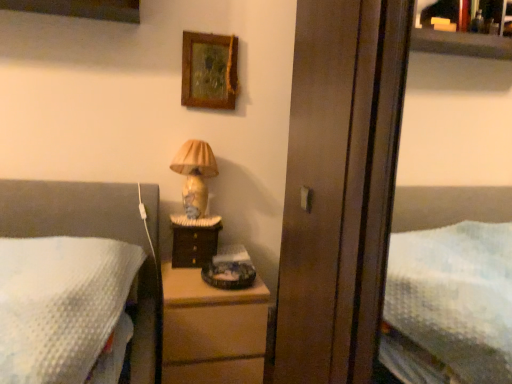
Image resolution: width=512 pixels, height=384 pixels. Describe the element at coordinates (211, 327) in the screenshot. I see `wooden chest of drawers at center` at that location.

Where is `wooden picture frame at upper center`? wooden picture frame at upper center is located at coordinates (209, 71).

The width and height of the screenshot is (512, 384). In order to click on wooden screen door at center in this screenshot , I will do 316,186.

The width and height of the screenshot is (512, 384). What are the coordinates of `screen door above the wooden chest of drawers at center (from the image's perspective)` in the screenshot? It's located at (x=316, y=186).

Does point (258, 286) appear closer or farther from the camera than point (292, 287)?

Clearly, point (258, 286) is more distant from the camera than point (292, 287).

Are wooden chest of drawers at center and wooden screen door at center far apart?

That's not correct — wooden chest of drawers at center is a little close to wooden screen door at center.

Can you tell me how much wooden chest of drawers at center and wooden screen door at center differ in facing direction?

The facing directions of wooden chest of drawers at center and wooden screen door at center are 92.1 degrees apart.

From their relative heights in the image, would you say matte ceramic lamp at upper center is taller or shorter than wooden picture frame at upper center?

matte ceramic lamp at upper center is taller than wooden picture frame at upper center.

Considering the relative positions of matte ceramic lamp at upper center and wooden picture frame at upper center in the image provided, is matte ceramic lamp at upper center behind wooden picture frame at upper center?

No, it is in front of wooden picture frame at upper center.

From the picture: From the image's perspective, is matte ceramic lamp at upper center below wooden picture frame at upper center?

Yes, from the image's perspective, matte ceramic lamp at upper center is beneath wooden picture frame at upper center.

Which is more to the left, matte ceramic lamp at upper center or wooden picture frame at upper center?

matte ceramic lamp at upper center is more to the left.

Which object is positioned more to the left, wooden picture frame at upper center or wooden chest of drawers at center?

From the viewer's perspective, wooden chest of drawers at center appears more on the left side.

Is wooden picture frame at upper center bigger than wooden chest of drawers at center?

Incorrect, wooden picture frame at upper center is not larger than wooden chest of drawers at center.

Which object is further away from the camera taking this photo, wooden picture frame at upper center or wooden chest of drawers at center?

wooden picture frame at upper center is further from the camera.

Can you confirm if matte ceramic lamp at upper center is smaller than dark wood nightstand at center?

No, matte ceramic lamp at upper center is not smaller than dark wood nightstand at center.

How many degrees apart are the facing directions of matte ceramic lamp at upper center and dark wood nightstand at center?

The facing directions of matte ceramic lamp at upper center and dark wood nightstand at center are 0.000605 degrees apart.

Is matte ceramic lamp at upper center aimed at dark wood nightstand at center?

No.

Considering the positions of points (182, 156) and (220, 224), is point (182, 156) closer to camera compared to point (220, 224)?

Yes.

Is dark wood nightstand at center touching wooden screen door at center?

They are not placed beside each other.

Can you confirm if dark wood nightstand at center is shorter than wooden screen door at center?

Yes.

Does point (192, 251) come behind point (346, 66)?

Yes, point (192, 251) is behind point (346, 66).

Which object is closer to the camera taking this photo, dark wood nightstand at center or wooden screen door at center?

wooden screen door at center.

Does wooden picture frame at upper center appear on the left side of dark wood nightstand at center?

No.

From the image's perspective, which is above, wooden picture frame at upper center or dark wood nightstand at center?

wooden picture frame at upper center.

Which of these two, wooden picture frame at upper center or dark wood nightstand at center, is thinner?

Thinner between the two is wooden picture frame at upper center.

How many degrees apart are the facing directions of wooden picture frame at upper center and dark wood nightstand at center?

There is a 0.122-degree angle between the facing directions of wooden picture frame at upper center and dark wood nightstand at center.

From the picture: Does wooden screen door at center have a greater width compared to dark wood nightstand at center?

Incorrect, the width of wooden screen door at center does not surpass that of dark wood nightstand at center.

Is wooden screen door at center behind dark wood nightstand at center?

No, wooden screen door at center is closer to the camera.

Is wooden screen door at center looking in the opposite direction of dark wood nightstand at center?

No, wooden screen door at center is not facing the opposite direction of dark wood nightstand at center.

This screenshot has width=512, height=384. Identify the location of screen door in front of the wooden chest of drawers at center. (316, 186).

Identify the location of picture frame above the matte ceramic lamp at upper center (from a real-world perspective). (209, 71).

Estimate the real-world distances between objects in this image. Which object is further from matte ceramic lamp at upper center, wooden chest of drawers at center or wooden screen door at center?

wooden screen door at center lies further to matte ceramic lamp at upper center than the other object.

Estimate the real-world distances between objects in this image. Which object is closer to matte ceramic lamp at upper center, dark wood nightstand at center or wooden screen door at center?

dark wood nightstand at center is closer to matte ceramic lamp at upper center.

From the image, which object appears to be farther from wooden screen door at center, wooden chest of drawers at center or wooden picture frame at upper center?

wooden picture frame at upper center is further to wooden screen door at center.

Considering their positions, is wooden picture frame at upper center positioned closer to wooden chest of drawers at center than wooden screen door at center?

wooden screen door at center is closer to wooden chest of drawers at center.

Considering their positions, is wooden picture frame at upper center positioned closer to matte ceramic lamp at upper center than wooden screen door at center?

The object closer to matte ceramic lamp at upper center is wooden picture frame at upper center.

Estimate the real-world distances between objects in this image. Which object is further from wooden screen door at center, wooden chest of drawers at center or dark wood nightstand at center?

dark wood nightstand at center is positioned further to the anchor wooden screen door at center.

Considering their positions, is wooden picture frame at upper center positioned further to wooden chest of drawers at center than dark wood nightstand at center?

Based on the image, wooden picture frame at upper center appears to be further to wooden chest of drawers at center.

Considering their positions, is wooden picture frame at upper center positioned closer to wooden screen door at center than wooden chest of drawers at center?

Based on the image, wooden chest of drawers at center appears to be nearer to wooden screen door at center.

Locate an element on the screen. The height and width of the screenshot is (384, 512). screen door between wooden picture frame at upper center and wooden chest of drawers at center in the vertical direction is located at coordinates (316, 186).

Where is `table lamp between wooden picture frame at upper center and wooden chest of drawers at center in the up-down direction`? table lamp between wooden picture frame at upper center and wooden chest of drawers at center in the up-down direction is located at coordinates (195, 175).

What are the coordinates of `table lamp positioned between wooden screen door at center and wooden picture frame at upper center from near to far` in the screenshot? It's located at (195, 175).

This screenshot has width=512, height=384. Identify the location of nightstand between wooden picture frame at upper center and wooden chest of drawers at center vertically. (194, 240).